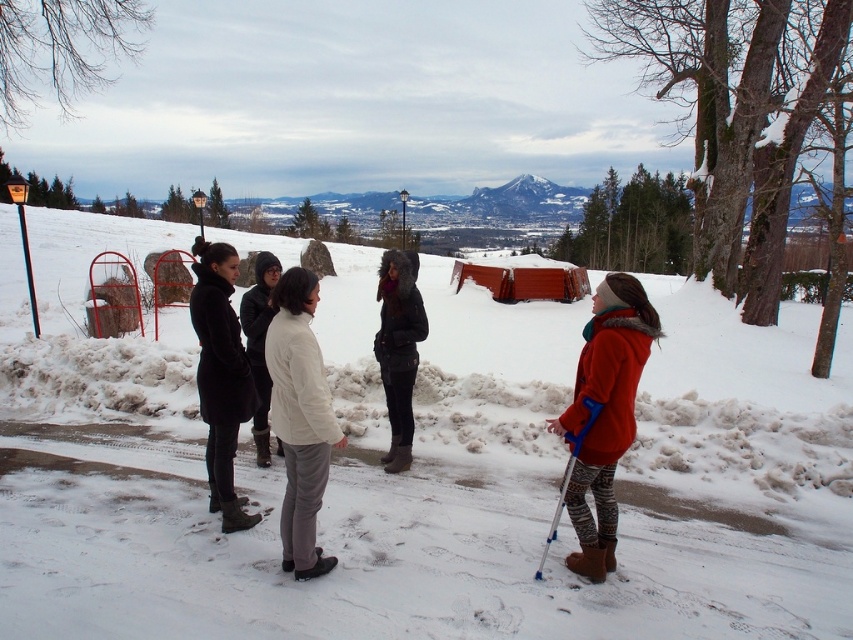
Question: Which point is closer to the camera?

Choices:
 (A) (231, 512)
 (B) (410, 262)
 (C) (589, 412)
 (D) (611, 422)

Answer: (C)

Question: Does dark brown fur coat at center appear on the right side of white woolen coat at center?

Choices:
 (A) yes
 (B) no

Answer: (A)

Question: Can you confirm if white snow ski slope at center is wider than matte red coat at center?

Choices:
 (A) no
 (B) yes

Answer: (B)

Question: Which is farther from the black wool coat at center?

Choices:
 (A) white snow ski slope at center
 (B) white matte jacket at center
 (C) matte red coat at center

Answer: (A)

Question: Is white matte jacket at center in front of dark brown fur coat at center?

Choices:
 (A) no
 (B) yes

Answer: (B)

Question: Among these objects, which one is nearest to the camera?

Choices:
 (A) blue plastic ski pole at lower right
 (B) white matte jacket at center
 (C) black wool coat at center
 (D) white woolen coat at center

Answer: (B)